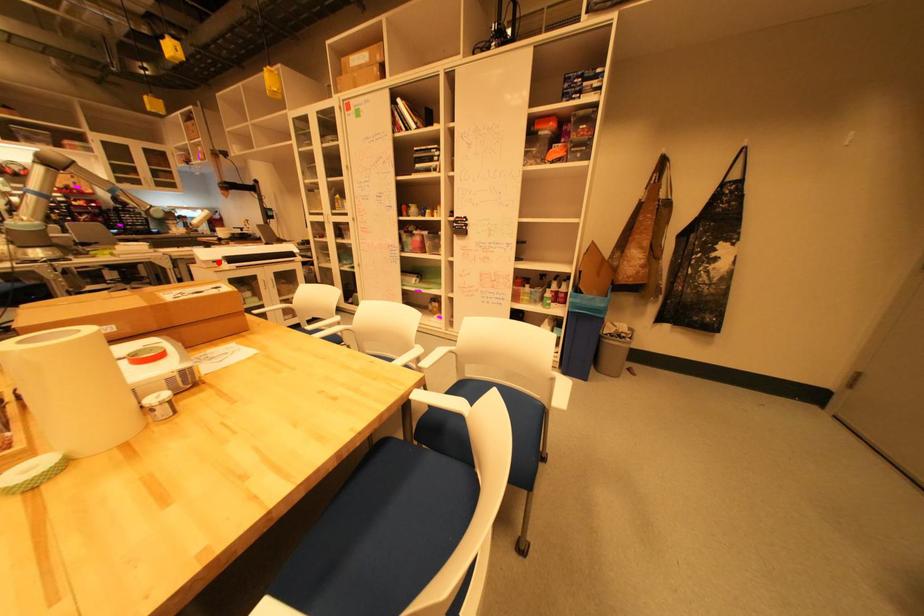
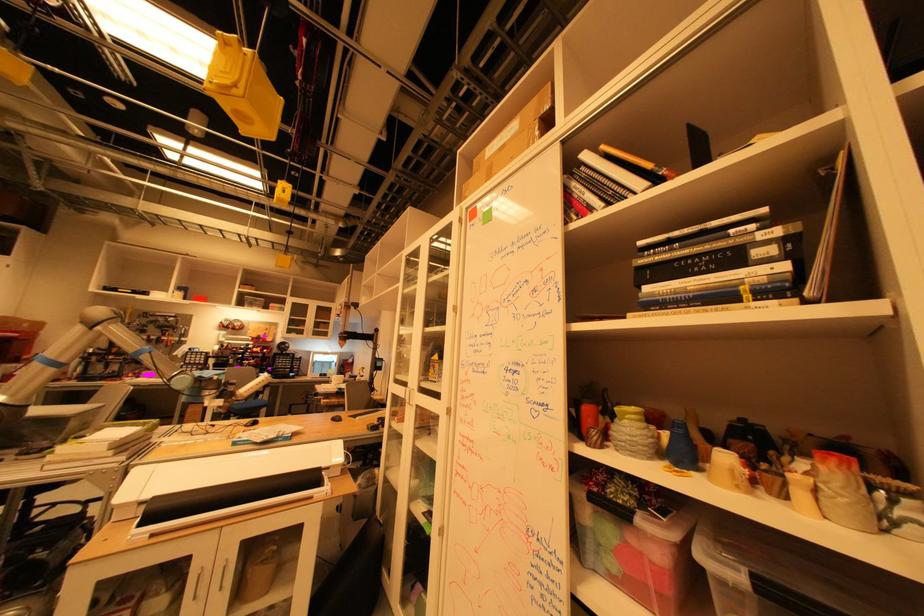
Question: I am providing you with two images of the same scene from different viewpoints. In image1, a red point is highlighted. Considering the same 3D point in image2, which of the following is correct?

Choices:
 (A) It is closer
 (B) It is farther

Answer: (A)